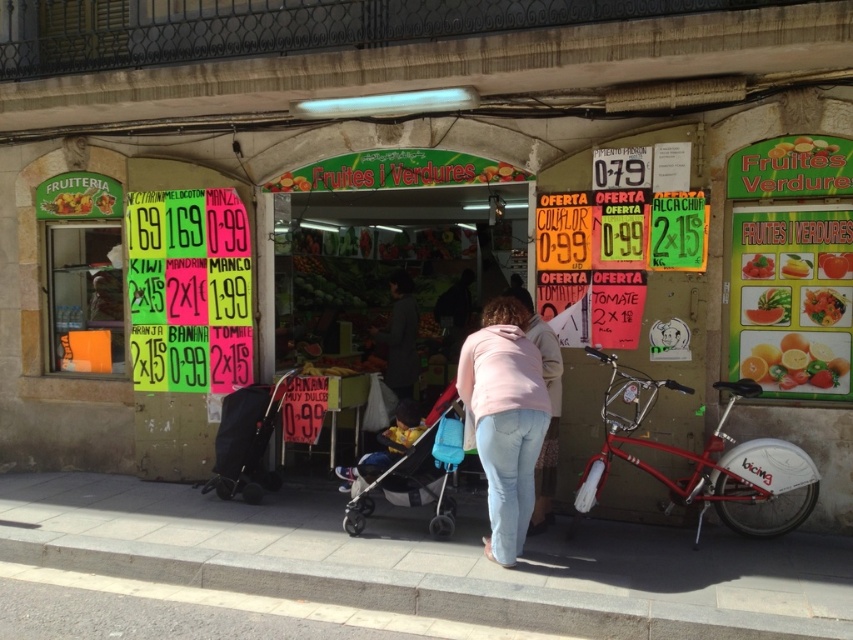
You are standing in front of the fruit market and want to take a photo. There are two points of interest marked as point 1 at coordinates (550, 392) and point 2 at coordinates (744, 316). Which point will appear closer to the camera in your photo?

Point 1 at coordinates (550, 392) will appear closer to the camera because it is closer to the camera than point 2 at coordinates (744, 316).

You are a delivery person standing at the entrance of the shop. You need to load a heavy box onto the shiny red bicycle at right. To do this, you must first move the box from the smooth concrete pavement at lower center to the bicycle. Is the bicycle accessible from the pavement?

The shiny red bicycle at right is behind the smooth concrete pavement at lower center, so you cannot directly access the bicycle from the pavement. You would need to move around the pavement to reach the bicycle.